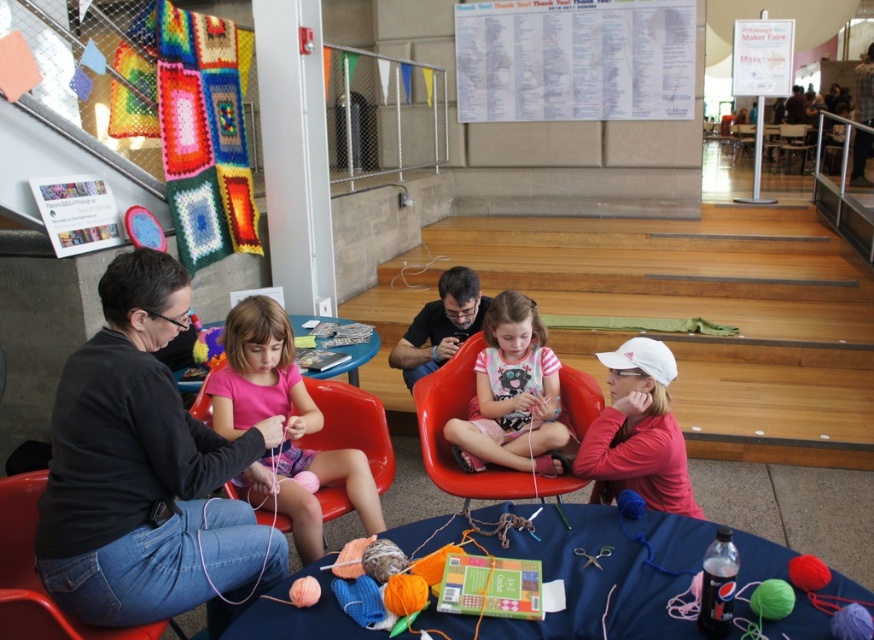
You are organizing a craft fair and need to arrange items on a table. You have a pink fabric at center and a matte plastic chair at center. Which item takes up less space on the table?

The pink fabric at center takes up less space on the table because it is smaller than the matte plastic chair at center.

You are standing at the entrance of the room and want to sit down. There is a point marked at coordinates (466, 419). What object is located at that point?

The point at coordinates (466, 419) corresponds to the matte plastic chair at center.

You are organizing a small craft workshop and need to seat two participants. You have two matte plastic chairs available. The first is the matte plastic chair at center and the second is the matte plastic chair at lower left. Which chair would be more comfortable for someone who prefers a spacious seating option?

The matte plastic chair at center is larger in size compared to the matte plastic chair at lower left, so it would provide more comfort for someone preferring a spacious seating option.